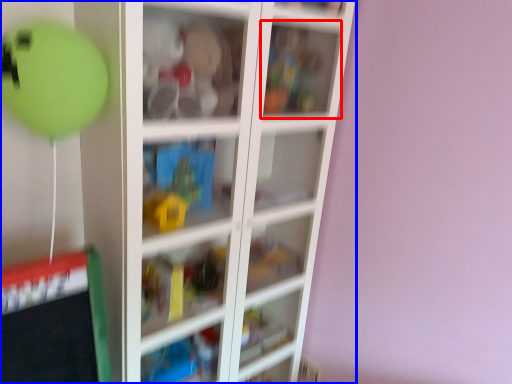
Question: Which of the following is the closest to the observer, cabinet (highlighted by a red box) or shelf (highlighted by a blue box)?

Choices:
 (A) cabinet
 (B) shelf

Answer: (B)